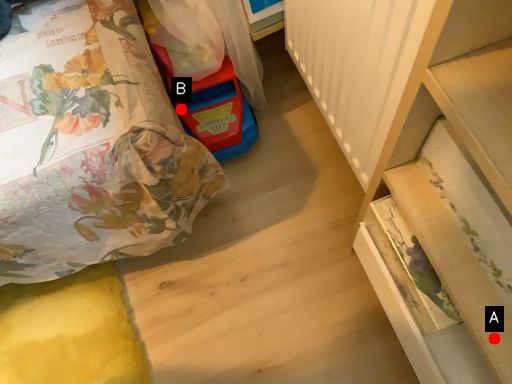
Question: Two points are circled on the image, labeled by A and B beside each circle. Among these points, which one is nearest to the camera?

Choices:
 (A) A is closer
 (B) B is closer

Answer: (A)